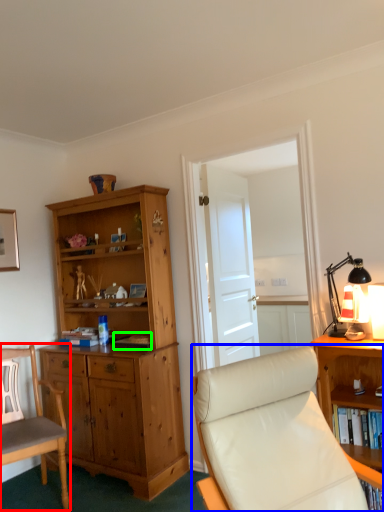
Question: Which is farther away from chair (highlighted by a red box)? chair (highlighted by a blue box) or book (highlighted by a green box)?

Choices:
 (A) chair
 (B) book

Answer: (A)